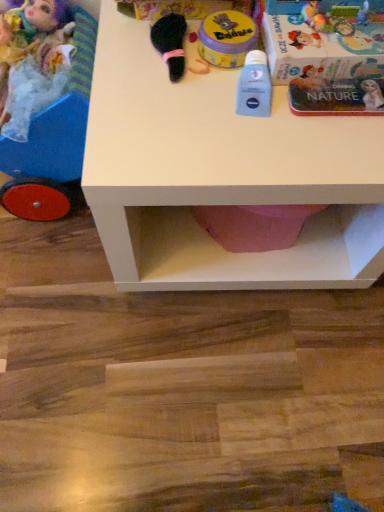
This screenshot has width=384, height=512. What are the coordinates of `free space that is to the left of yellow matte container at upper center, positioned as the third toy in left-to-right order` in the screenshot? It's located at (139, 50).